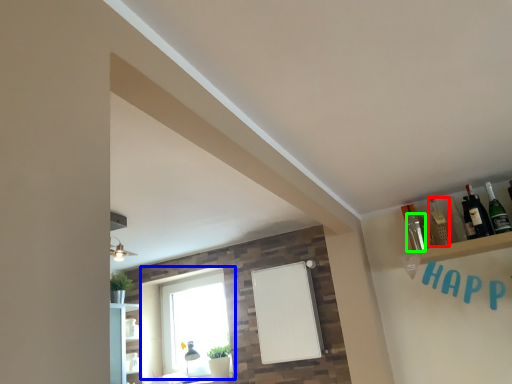
Question: Based on their relative distances, which object is nearer to bottle (highlighted by a red box)? Choose from window (highlighted by a blue box) and bottle (highlighted by a green box).

Choices:
 (A) window
 (B) bottle

Answer: (B)